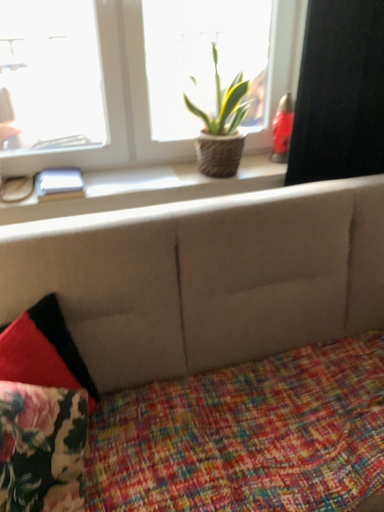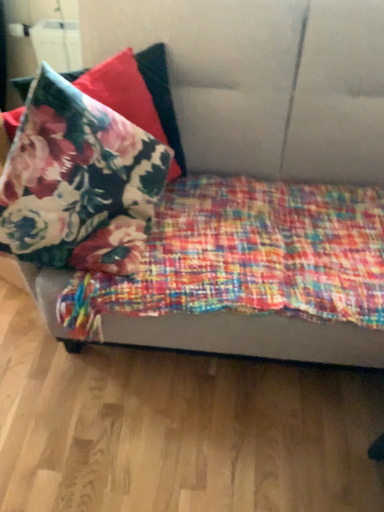
Question: How did the camera likely rotate when shooting the video?

Choices:
 (A) rotated upward
 (B) rotated downward

Answer: (B)